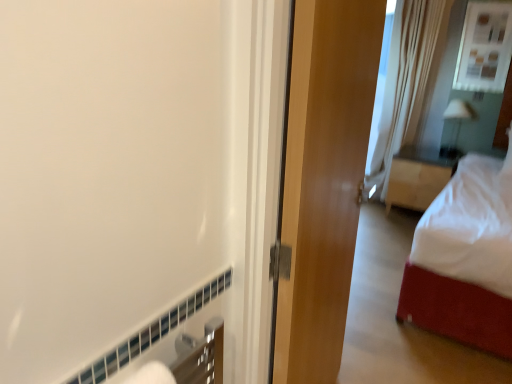
Question: From the image's perspective, is white soft bed at right above matte glass window at upper right?

Choices:
 (A) yes
 (B) no

Answer: (B)

Question: Is white soft bed at right looking in the opposite direction of matte glass window at upper right?

Choices:
 (A) yes
 (B) no

Answer: (B)

Question: Is white soft bed at right shorter than matte glass window at upper right?

Choices:
 (A) yes
 (B) no

Answer: (B)

Question: Is white soft bed at right outside of matte glass window at upper right?

Choices:
 (A) yes
 (B) no

Answer: (A)

Question: Can you confirm if white soft bed at right is taller than matte glass window at upper right?

Choices:
 (A) yes
 (B) no

Answer: (A)

Question: Does white soft bed at right have a smaller size compared to matte glass window at upper right?

Choices:
 (A) yes
 (B) no

Answer: (B)

Question: From a real-world perspective, does white soft bed at right stand above glossy wood door at center?

Choices:
 (A) yes
 (B) no

Answer: (A)

Question: Does white soft bed at right have a larger size compared to glossy wood door at center?

Choices:
 (A) no
 (B) yes

Answer: (B)

Question: Is white soft bed at right facing away from glossy wood door at center?

Choices:
 (A) no
 (B) yes

Answer: (A)

Question: Would you say white soft bed at right is a long distance from glossy wood door at center?

Choices:
 (A) no
 (B) yes

Answer: (B)

Question: Is white soft bed at right outside glossy wood door at center?

Choices:
 (A) yes
 (B) no

Answer: (A)

Question: Can you confirm if white soft bed at right is positioned to the right of glossy wood door at center?

Choices:
 (A) yes
 (B) no

Answer: (A)

Question: Is white glossy lamp at upper right in contact with glossy wood door at center?

Choices:
 (A) yes
 (B) no

Answer: (B)